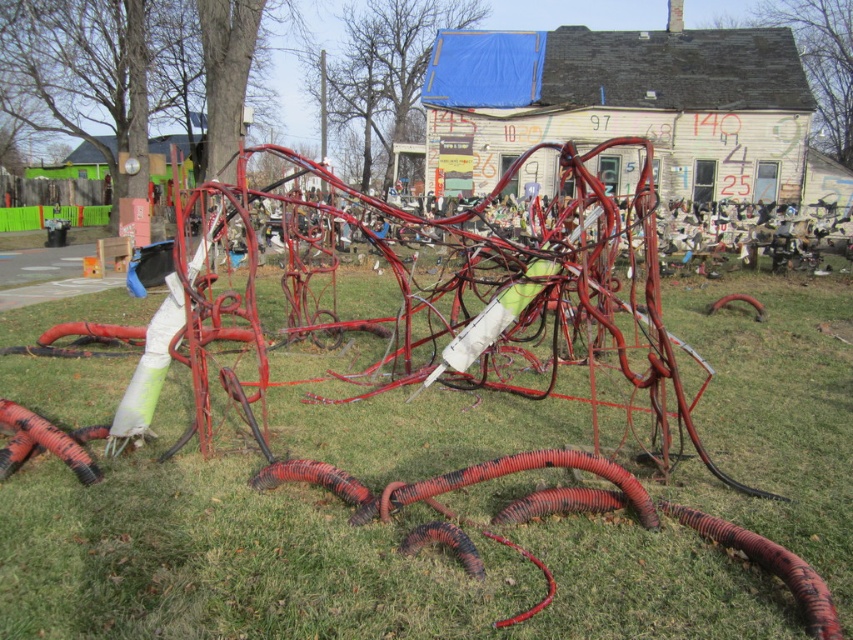
Which is in front, point (453, 449) or point (0, 422)?

Positioned in front is point (0, 422).

Who is lower down, green grass at center or rubber hose at lower left?

Positioned lower is rubber hose at lower left.

Between point (54, 499) and point (96, 464), which one is positioned in front?

Point (54, 499)

Locate an element on the screen. The height and width of the screenshot is (640, 853). green grass at center is located at coordinates (332, 563).